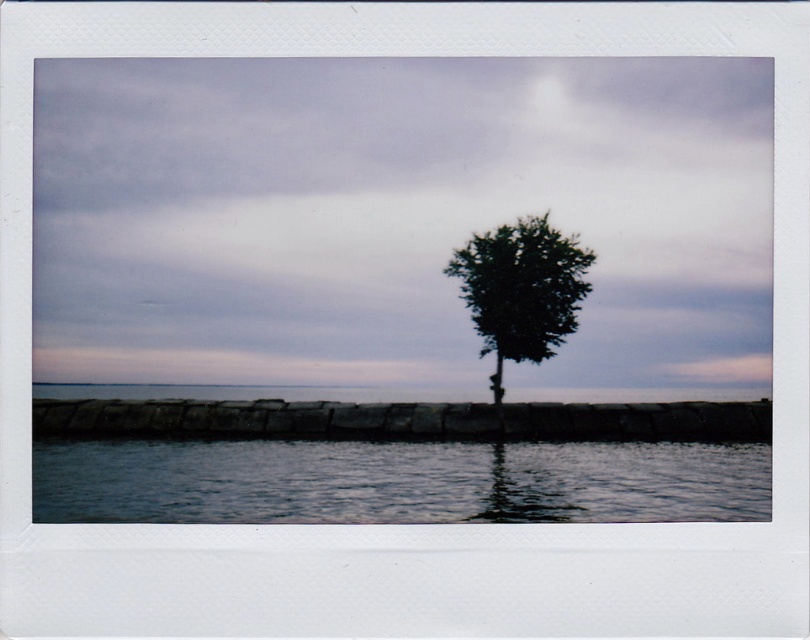
The width and height of the screenshot is (810, 640). What do you see at coordinates (395, 481) in the screenshot?
I see `clear water at lower center` at bounding box center [395, 481].

You are a GUI agent. You are given a task and a screenshot of the screen. Output one action in this format:
    pyautogui.click(x=<x>, y=<y>)
    Task: Click on the clear water at lower center
    
    Given the screenshot: What is the action you would take?
    pyautogui.click(x=395, y=481)